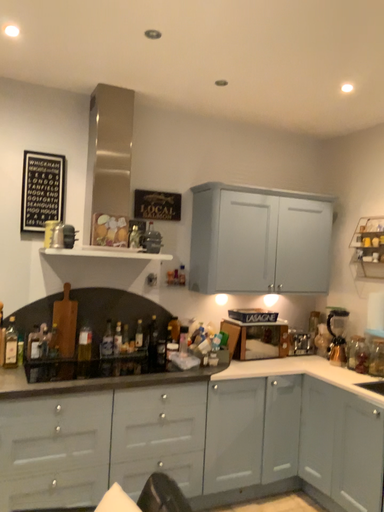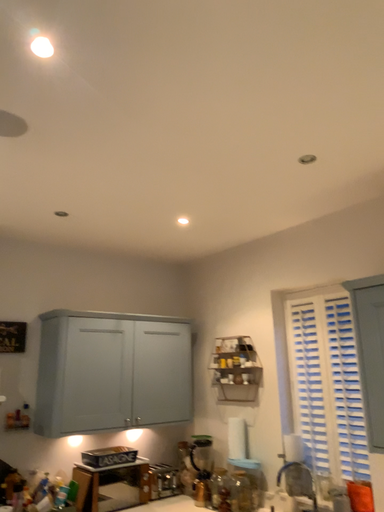
Question: Which way did the camera rotate in the video?

Choices:
 (A) rotated left
 (B) rotated right

Answer: (B)